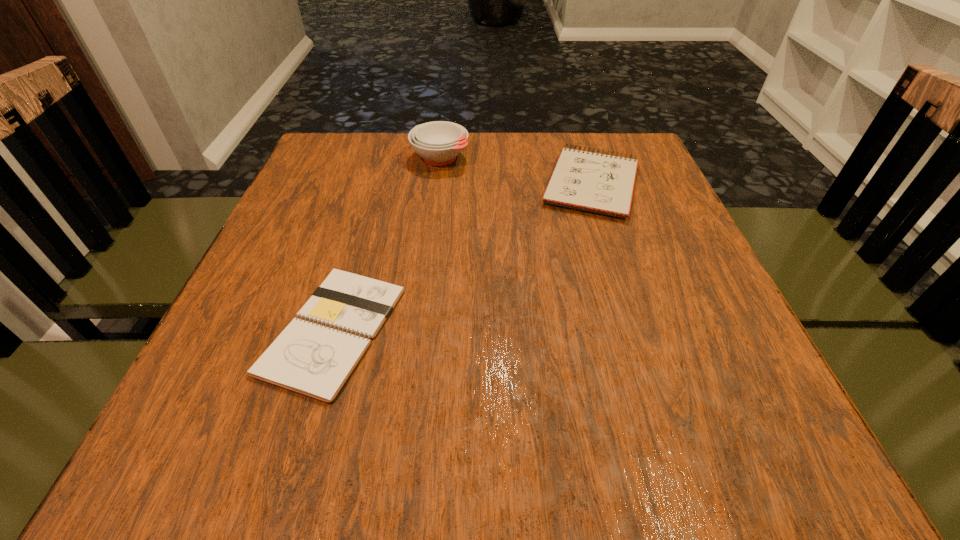
Select which object is the second closest to the nearer notepad. Please provide its 2D coordinates. Your answer should be formatted as a tuple, i.e. [(x, y)], where the tuple contains the x and y coordinates of a point satisfying the conditions above.

[(439, 142)]

Find the location of a particular element. The image size is (960, 540). vacant region that satisfies the following two spatial constraints: 1. on the front side of the tallest object; 2. on the right side of the rightmost object is located at coordinates (437, 184).

Image resolution: width=960 pixels, height=540 pixels. Identify the location of vacant area in the image that satisfies the following two spatial constraints: 1. on the back side of the tallest object; 2. on the right side of the shorter notepad. (385, 158).

Find the location of a particular element. This screenshot has width=960, height=540. blank space that satisfies the following two spatial constraints: 1. on the back side of the nearest object; 2. on the right side of the tallest object is located at coordinates (385, 158).